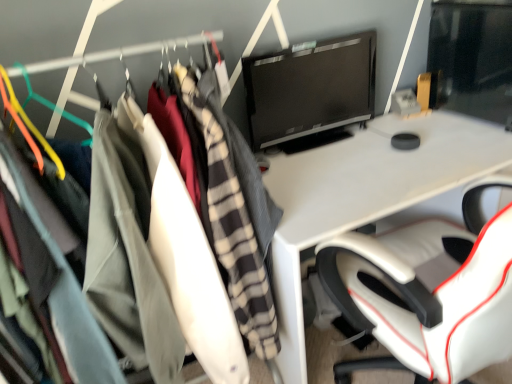
Question: From a real-world perspective, is light gray fabric coat at left on black glossy monitor at upper right?

Choices:
 (A) yes
 (B) no

Answer: (B)

Question: Considering the relative sizes of light gray fabric coat at left and black glossy monitor at upper right in the image provided, is light gray fabric coat at left thinner than black glossy monitor at upper right?

Choices:
 (A) yes
 (B) no

Answer: (B)

Question: From a real-world perspective, is light gray fabric coat at left under black glossy monitor at upper right?

Choices:
 (A) yes
 (B) no

Answer: (A)

Question: Would you say light gray fabric coat at left contains black glossy monitor at upper right?

Choices:
 (A) yes
 (B) no

Answer: (B)

Question: Does light gray fabric coat at left touch black glossy monitor at upper right?

Choices:
 (A) no
 (B) yes

Answer: (A)

Question: From the image's perspective, is light gray fabric coat at left above black glossy monitor at upper right?

Choices:
 (A) no
 (B) yes

Answer: (A)

Question: From a real-world perspective, is black glossy monitor at upper right physically below light gray fabric coat at left?

Choices:
 (A) no
 (B) yes

Answer: (A)

Question: Is black glossy monitor at upper right smaller than light gray fabric coat at left?

Choices:
 (A) yes
 (B) no

Answer: (A)

Question: Is black glossy monitor at upper right facing away from light gray fabric coat at left?

Choices:
 (A) no
 (B) yes

Answer: (A)

Question: Considering the relative sizes of black glossy monitor at upper right and light gray fabric coat at left in the image provided, is black glossy monitor at upper right taller than light gray fabric coat at left?

Choices:
 (A) yes
 (B) no

Answer: (B)

Question: Is black glossy monitor at upper right located outside light gray fabric coat at left?

Choices:
 (A) no
 (B) yes

Answer: (B)

Question: Can you confirm if black glossy monitor at upper right is positioned to the right of light gray fabric coat at left?

Choices:
 (A) yes
 (B) no

Answer: (A)

Question: From the image's perspective, is light gray fabric coat at left positioned above or below black glossy monitor at upper right?

Choices:
 (A) above
 (B) below

Answer: (B)